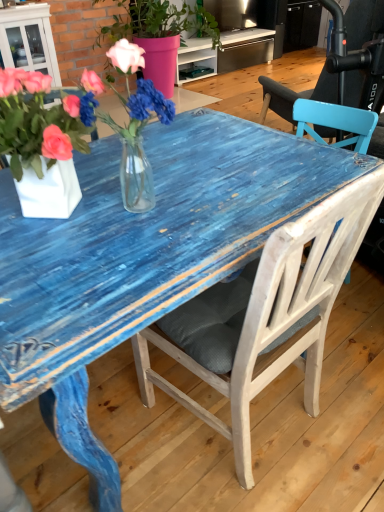
Question: Can you confirm if pink matte vase at upper center, the first houseplant in the top-to-bottom sequence, is shorter than translucent glass vase at center?

Choices:
 (A) no
 (B) yes

Answer: (A)

Question: Is pink matte vase at upper center, positioned as the second houseplant in front-to-back order, not inside translucent glass vase at center?

Choices:
 (A) yes
 (B) no

Answer: (A)

Question: From a real-world perspective, is pink matte vase at upper center, placed as the second houseplant when sorted from bottom to top, under translucent glass vase at center?

Choices:
 (A) yes
 (B) no

Answer: (A)

Question: Is pink matte vase at upper center, which is the first houseplant in back-to-front order, directly adjacent to translucent glass vase at center?

Choices:
 (A) no
 (B) yes

Answer: (A)

Question: Is pink matte vase at upper center, positioned as the second houseplant in front-to-back order, looking in the opposite direction of translucent glass vase at center?

Choices:
 (A) yes
 (B) no

Answer: (B)

Question: Is pink matte vase at upper center, positioned as the second houseplant in front-to-back order, positioned behind translucent glass vase at center?

Choices:
 (A) yes
 (B) no

Answer: (A)

Question: Can you confirm if white matte vase at left, arranged as the first houseplant when ordered from the bottom, is smaller than pink matte vase at upper center, positioned as the second houseplant in front-to-back order?

Choices:
 (A) no
 (B) yes

Answer: (B)

Question: From the image's perspective, does white matte vase at left, which is the 2th houseplant from back to front, appear lower than pink matte vase at upper center, placed as the second houseplant when sorted from bottom to top?

Choices:
 (A) yes
 (B) no

Answer: (A)

Question: From the image's perspective, would you say white matte vase at left, arranged as the first houseplant when ordered from the bottom, is positioned over pink matte vase at upper center, which is the first houseplant in back-to-front order?

Choices:
 (A) no
 (B) yes

Answer: (A)

Question: From a real-world perspective, is white matte vase at left, arranged as the first houseplant when ordered from the bottom, located higher than pink matte vase at upper center, positioned as the second houseplant in front-to-back order?

Choices:
 (A) yes
 (B) no

Answer: (A)

Question: Is white matte vase at left, the 2th houseplant in the top-to-bottom sequence, outside pink matte vase at upper center, which is the first houseplant in back-to-front order?

Choices:
 (A) no
 (B) yes

Answer: (B)

Question: Is the position of white matte vase at left, which is the 2th houseplant from back to front, more distant than that of pink matte vase at upper center, the first houseplant in the top-to-bottom sequence?

Choices:
 (A) yes
 (B) no

Answer: (B)

Question: Considering the relative sizes of white wood chair at center and translucent glass vase at center in the image provided, is white wood chair at center taller than translucent glass vase at center?

Choices:
 (A) no
 (B) yes

Answer: (B)